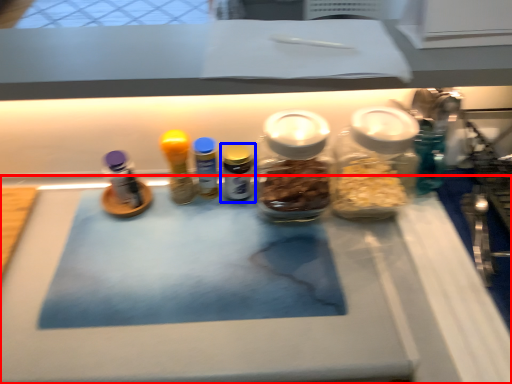
Question: Which of the following is the closest to the observer, table (highlighted by a red box) or bottle (highlighted by a blue box)?

Choices:
 (A) table
 (B) bottle

Answer: (A)